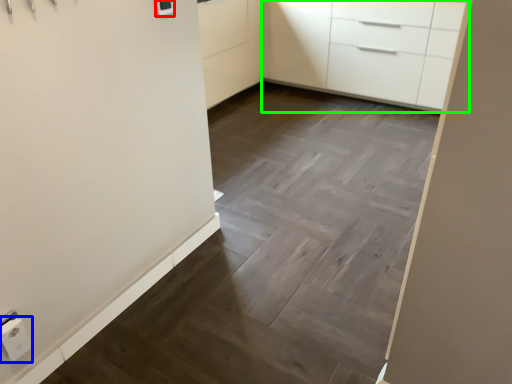
Question: Considering the real-world distances, which object is farthest from light switch (highlighted by a red box)? electric outlet (highlighted by a blue box) or chest of drawers (highlighted by a green box)?

Choices:
 (A) electric outlet
 (B) chest of drawers

Answer: (B)